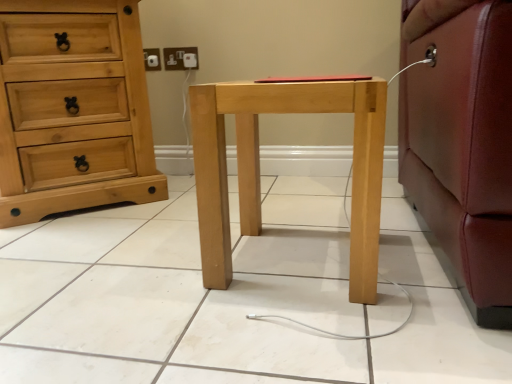
Question: In the image, is white plastic electric outlet at upper center on the left side or the right side of natural wood chest of drawers at left?

Choices:
 (A) right
 (B) left

Answer: (A)

Question: Choose the correct answer: Is white plastic electric outlet at upper center inside natural wood chest of drawers at left or outside it?

Choices:
 (A) inside
 (B) outside

Answer: (B)

Question: Which of these objects is positioned closest to the white plastic electric outlet at upper center?

Choices:
 (A) natural wood chest of drawers at left
 (B) natural wood nightstand at center

Answer: (A)

Question: Which object is positioned farthest from the natural wood nightstand at center?

Choices:
 (A) natural wood chest of drawers at left
 (B) white plastic electric outlet at upper center

Answer: (B)